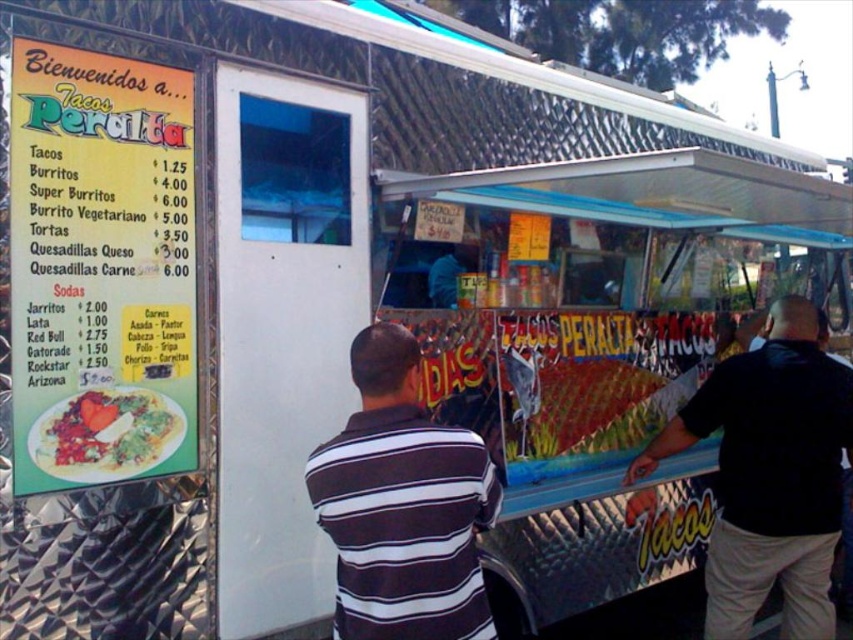
Find the location of a particular element. This screenshot has height=640, width=853. striped polo shirt at center is located at coordinates (402, 506).

Which is behind, point (398, 481) or point (97, 420)?

Positioned behind is point (97, 420).

Does point (352, 618) come closer to viewer compared to point (123, 464)?

Yes, point (352, 618) is in front of point (123, 464).

Image resolution: width=853 pixels, height=640 pixels. Identify the location of striped polo shirt at center. (402, 506).

Is black matte shirt at right below striped polo shirt at center?

Yes, black matte shirt at right is below striped polo shirt at center.

Does black matte shirt at right appear on the left side of striped polo shirt at center?

In fact, black matte shirt at right is to the right of striped polo shirt at center.

Locate an element on the screen. black matte shirt at right is located at coordinates (770, 474).

Between green paper menu at upper left and striped polo shirt at center, which one has more height?

Standing taller between the two is green paper menu at upper left.

Is green paper menu at upper left taller than striped polo shirt at center?

Indeed, green paper menu at upper left has a greater height compared to striped polo shirt at center.

Between point (132, 188) and point (402, 460), which one is positioned in front?

Positioned in front is point (402, 460).

This screenshot has width=853, height=640. Identify the location of green paper menu at upper left. (100, 268).